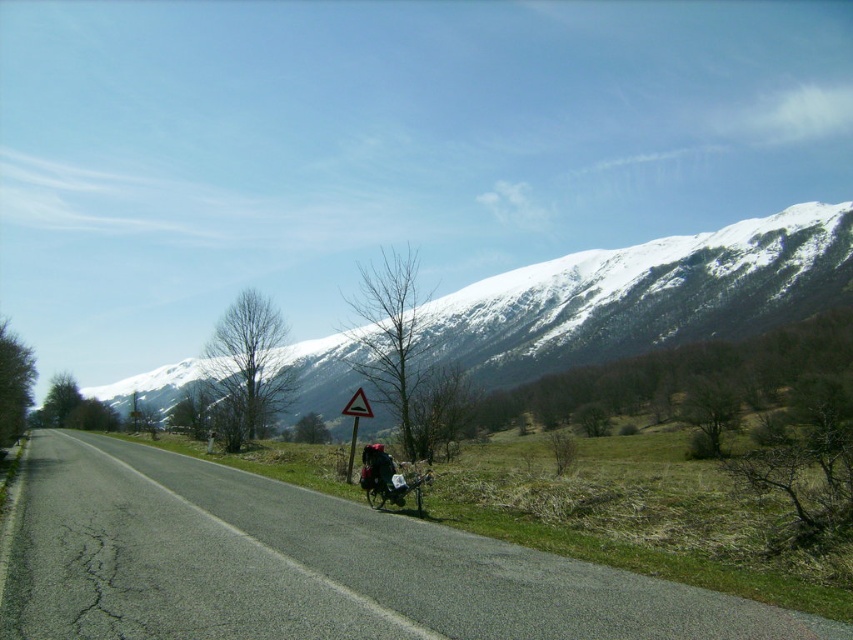
Question: Which object is the farthest from the triangular reflective plastic traffic sign at center?

Choices:
 (A) metallic silver motorcycle at center
 (B) snowy mountain at upper center

Answer: (B)

Question: Based on their relative distances, which object is nearer to the asphalt road at center?

Choices:
 (A) white plastic triangle at center
 (B) snowy mountain at upper center

Answer: (A)

Question: Does asphalt road at center have a greater width compared to triangular reflective plastic traffic sign at center?

Choices:
 (A) no
 (B) yes

Answer: (B)

Question: Considering the relative positions of snowy mountain at upper center and triangular reflective plastic traffic sign at center in the image provided, where is snowy mountain at upper center located with respect to triangular reflective plastic traffic sign at center?

Choices:
 (A) left
 (B) right

Answer: (A)

Question: Which is farther from the triangular reflective plastic traffic sign at center?

Choices:
 (A) snowy mountain at upper center
 (B) metallic silver motorcycle at center
 (C) white plastic triangle at center
 (D) asphalt road at center

Answer: (A)

Question: Does asphalt road at center have a greater width compared to white plastic triangle at center?

Choices:
 (A) no
 (B) yes

Answer: (B)